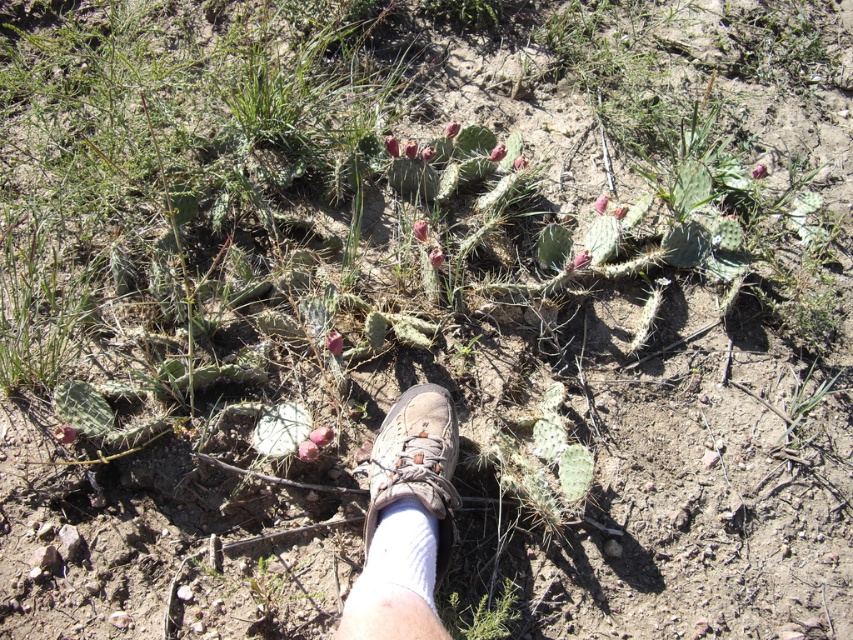
You are a hiker who wants to avoid stepping on the green spiky cactus at lower center. Your brown suede shoe at center is currently positioned where? Is there enough space between them to move your foot away safely?

The distance between the brown suede shoe at center and the green spiky cactus at lower center is 10.61 inches. Since this distance is sufficient to move your foot away without touching the cactus, you can safely reposition your foot.

You are a hiker trying to avoid stepping on the green spiky cactus at lower center. You have a brown suede shoe at center. Can your shoe completely cover the cactus without touching it? Explain based on their sizes.

The brown suede shoe at center is wider than the green spiky cactus at lower center. Therefore, the shoe can completely cover the cactus without touching it by positioning it in the center.

You are a hiker who accidentally stepped on a prickly pear cactus. You notice a point marked at coordinates [416,461]. Based on the scene description, where is this point located?

The point at coordinates [416,461] is located on the brown suede shoe at center, which is where the hiker stepped on the prickly pear cacti.